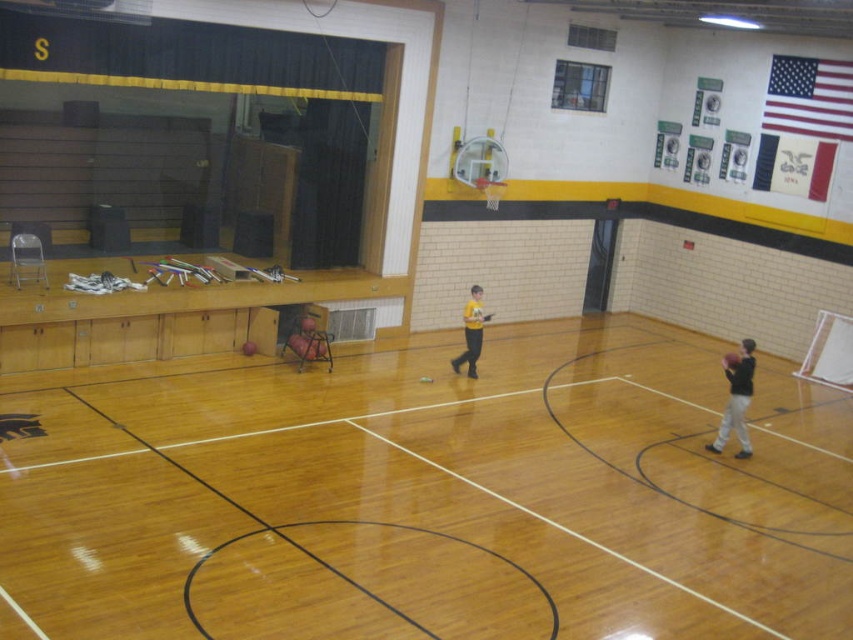
Looking at this image, you are a gym teacher trying to store equipment. You have a storage box that can only fit items wider than 30 cm. Based on the image, will the matte black basketball at right and the yellow matte shirt at center both fit in the box?

The matte black basketball at right is larger in width than the yellow matte shirt at center. Since the basketball is wider than the shirt, but we don not know the exact width of the basketball, we cannot determine if both will fit in the box. The description only states the basketball is larger than the shirt, not their specific measurements.

You are a basketball coach observing the court. You notice a matte black basketball at right and a yellow matte shirt at center. Which object is higher in position?

The matte black basketball at right is much taller than the yellow matte shirt at center, so the matte black basketball at right is higher in position.

You are a gym teacher observing the basketball court. You notice a matte black basketball at right and a yellow matte shirt at center. Which object is positioned lower in the scene?

The matte black basketball at right is located below the yellow matte shirt at center, so it is positioned lower in the scene.